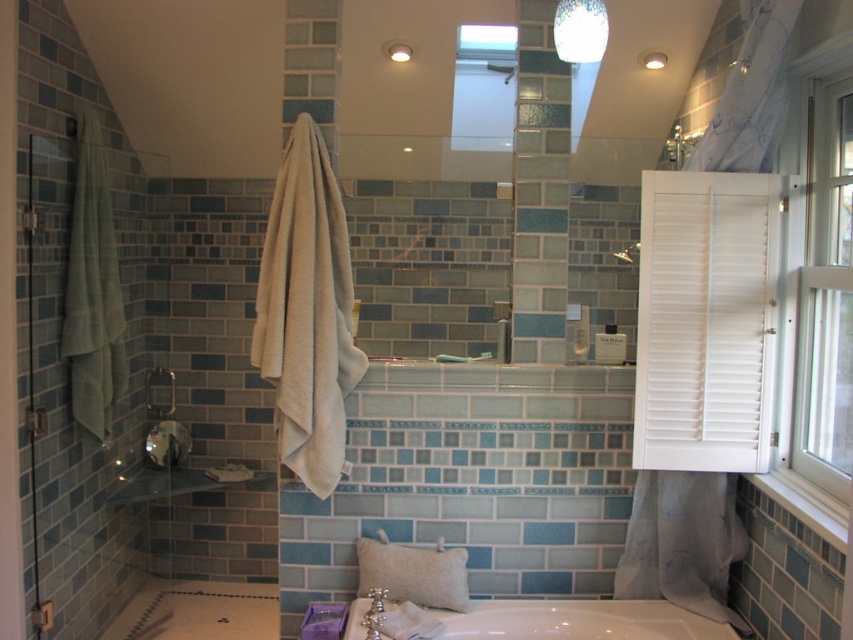
Locate an element on the screen. The width and height of the screenshot is (853, 640). white matte shutter at right is located at coordinates (706, 321).

Can you confirm if white matte shutter at right is positioned to the right of white wooden shutter at right?

Incorrect, white matte shutter at right is not on the right side of white wooden shutter at right.

The width and height of the screenshot is (853, 640). I want to click on white matte shutter at right, so click(x=706, y=321).

How much distance is there between white wooden shutter at right and white glossy bathtub at center?

white wooden shutter at right and white glossy bathtub at center are 89.98 centimeters apart.

What do you see at coordinates (822, 282) in the screenshot? I see `white wooden shutter at right` at bounding box center [822, 282].

Locate an element on the screen. The width and height of the screenshot is (853, 640). white wooden shutter at right is located at coordinates (822, 282).

What are the coordinates of `white wooden shutter at right` in the screenshot? It's located at (822, 282).

Is white glossy bathtub at center to the right of beige fabric pillow at lower center from the viewer's perspective?

Indeed, white glossy bathtub at center is positioned on the right side of beige fabric pillow at lower center.

Who is taller, white glossy bathtub at center or beige fabric pillow at lower center?

With more height is beige fabric pillow at lower center.

Where is `white glossy bathtub at center`? This screenshot has height=640, width=853. white glossy bathtub at center is located at coordinates (578, 620).